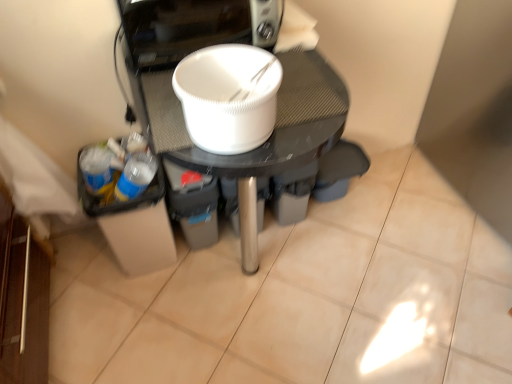
You are a GUI agent. You are given a task and a screenshot of the screen. Output one action in this format:
    pyautogui.click(x=<x>, y=<y>)
    Task: Click on the white matte bowl at center
    The image size is (512, 384).
    Given the screenshot: What is the action you would take?
    pyautogui.click(x=239, y=105)

Describe the element at coordinates (239, 105) in the screenshot. I see `white matte bowl at center` at that location.

In the scene shown: Measure the distance between point (270, 97) and camera.

The depth of point (270, 97) is 31.26 inches.

Image resolution: width=512 pixels, height=384 pixels. What do you see at coordinates (228, 97) in the screenshot?
I see `white matte bowl at center` at bounding box center [228, 97].

You are a GUI agent. You are given a task and a screenshot of the screen. Output one action in this format:
    pyautogui.click(x=<x>, y=<y>)
    Task: Click on the white matte bowl at center
    Image resolution: width=512 pixels, height=384 pixels.
    Given the screenshot: What is the action you would take?
    pyautogui.click(x=228, y=97)

What is the approximate width of white matte bowl at center?

It is 8.86 inches.

I want to click on white matte bowl at center, so click(x=239, y=105).

Looking at this image, which object is positioned more to the left, white matte bowl at center or white matte bowl at center?

Positioned to the left is white matte bowl at center.

Is white matte bowl at center closer to camera compared to white matte bowl at center?

Yes, white matte bowl at center is closer to the camera.

Considering the positions of point (247, 58) and point (358, 160), is point (247, 58) closer or farther from the camera than point (358, 160)?

Clearly, point (247, 58) is closer to the camera than point (358, 160).

From the image's perspective, is white matte bowl at center located above or below white matte bowl at center?

Clearly, from the image's perspective, white matte bowl at center is above white matte bowl at center.

From a real-world perspective, between white matte bowl at center and white matte bowl at center, who is vertically higher?

From a 3D spatial view, white matte bowl at center is above.

Which object is thinner, white matte bowl at center or white matte bowl at center?

With smaller width is white matte bowl at center.

Considering the sizes of objects white matte bowl at center and white matte bowl at center in the image provided, who is taller, white matte bowl at center or white matte bowl at center?

white matte bowl at center is taller.

Based on their sizes in the image, would you say white matte bowl at center is bigger or smaller than white matte bowl at center?

Clearly, white matte bowl at center is smaller in size than white matte bowl at center.

Would you say white matte bowl at center is inside or outside white matte bowl at center?

white matte bowl at center exists outside the volume of white matte bowl at center.

In the scene shown: Is there a large distance between white matte bowl at center and white matte bowl at center?

A: white matte bowl at center is actually quite close to white matte bowl at center.

Is white matte bowl at center facing away from white matte bowl at center?

No, white matte bowl at center is not facing away from white matte bowl at center.

Consider the image. What's the angular difference between white matte bowl at center and white matte bowl at center's facing directions?

white matte bowl at center and white matte bowl at center are facing 2.38 degrees away from each other.

This screenshot has height=384, width=512. Identify the location of appliance behind the white matte bowl at center. (239, 105).

Can you confirm if white matte bowl at center is positioned to the right of white matte bowl at center?

In fact, white matte bowl at center is to the left of white matte bowl at center.

Relative to white matte bowl at center, is white matte bowl at center in front or behind?

Clearly, white matte bowl at center is behind white matte bowl at center.

Does point (181, 119) lie in front of point (201, 64)?

No, it is behind (201, 64).

From the image's perspective, is white matte bowl at center above or below white matte bowl at center?

white matte bowl at center is situated lower than white matte bowl at center in the image.

From a real-world perspective, is white matte bowl at center physically above white matte bowl at center?

No, from a real-world perspective, white matte bowl at center is not on top of white matte bowl at center.

Can you confirm if white matte bowl at center is thinner than white matte bowl at center?

Incorrect, the width of white matte bowl at center is not less than that of white matte bowl at center.

Can you confirm if white matte bowl at center is shorter than white matte bowl at center?

No, white matte bowl at center is not shorter than white matte bowl at center.

Considering the sizes of white matte bowl at center and white matte bowl at center in the image, is white matte bowl at center bigger or smaller than white matte bowl at center?

white matte bowl at center is bigger than white matte bowl at center.

Looking at this image, is white matte bowl at center completely or partially outside of white matte bowl at center?

Absolutely, white matte bowl at center is external to white matte bowl at center.

Are white matte bowl at center and white matte bowl at center beside each other?

Yes, the surface of white matte bowl at center is in contact with white matte bowl at center.

From the picture: Is white matte bowl at center at the back of white matte bowl at center?

white matte bowl at center is not turned away from white matte bowl at center.

Can you tell me how much white matte bowl at center and white matte bowl at center differ in facing direction?

They differ by 2.38 degrees in their facing directions.

Based on the photo, how much distance is there between white matte bowl at center and white matte bowl at center?

They are 2.07 inches apart.

Image resolution: width=512 pixels, height=384 pixels. In order to click on appliance lying behind the white matte bowl at center in this screenshot , I will do `click(239, 105)`.

Locate an element on the screen. tableware that is in front of the white matte bowl at center is located at coordinates (228, 97).

The width and height of the screenshot is (512, 384). Find the location of `appliance below the white matte bowl at center (from the image's perspective)`. appliance below the white matte bowl at center (from the image's perspective) is located at coordinates (239, 105).